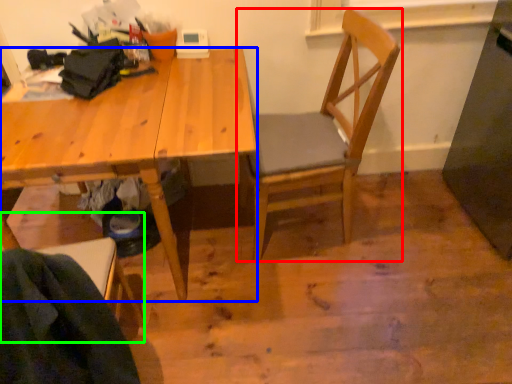
Question: Which object is the farthest from chair (highlighted by a red box)? Choose among these: desk (highlighted by a blue box) or chair (highlighted by a green box).

Choices:
 (A) desk
 (B) chair

Answer: (B)